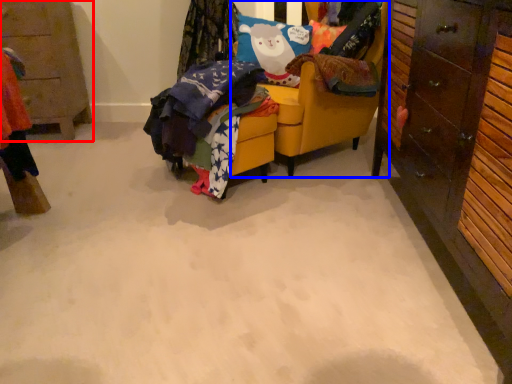
Question: Which object appears closest to the camera in this image, cabinetry (highlighted by a red box) or chair (highlighted by a blue box)?

Choices:
 (A) cabinetry
 (B) chair

Answer: (B)